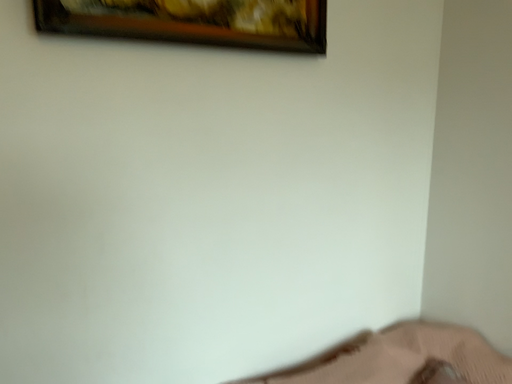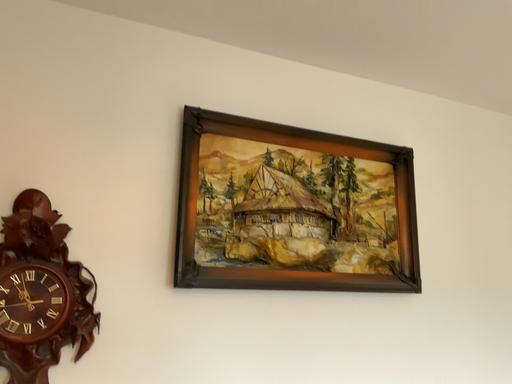
Question: Which way did the camera rotate in the video?

Choices:
 (A) rotated upward
 (B) rotated downward

Answer: (A)